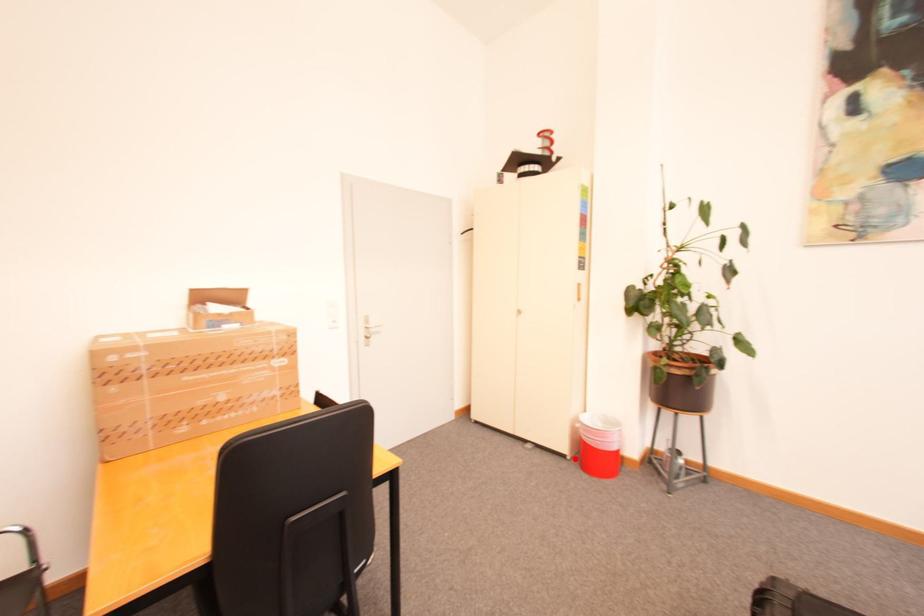
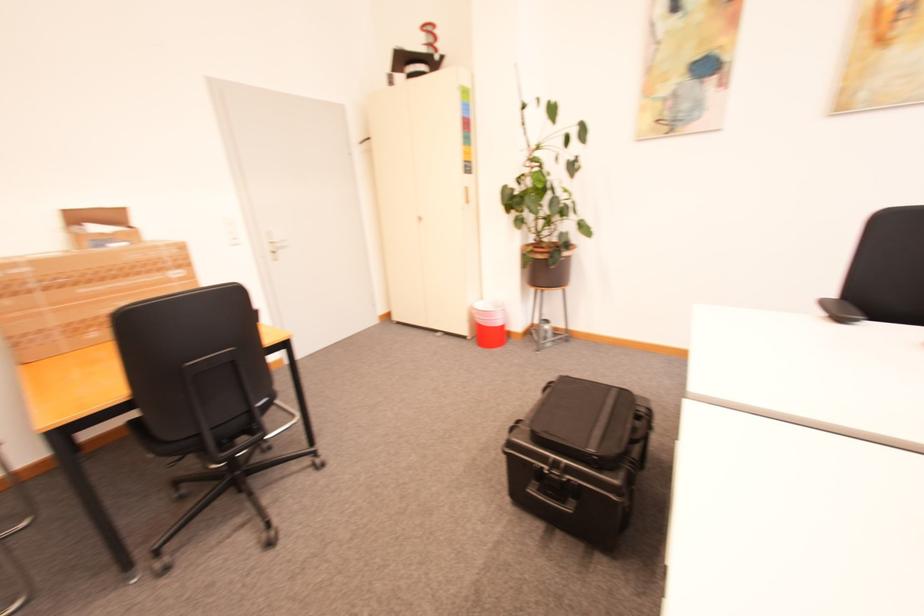
The point at the highlighted location is marked in the first image. Where is the corresponding point in the second image?

(476, 339)